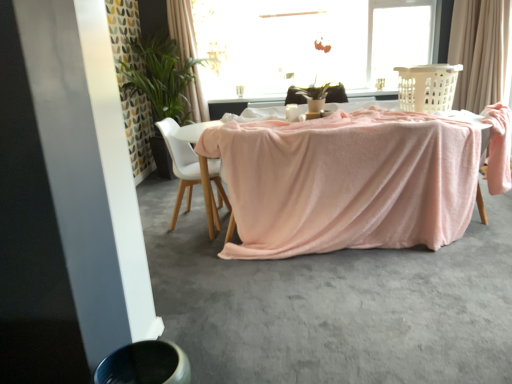
Question: Considering the relative sizes of beige fabric curtain at upper right, the 2th curtain in the left-to-right sequence, and transparent glass window at upper center in the image provided, is beige fabric curtain at upper right, the 2th curtain in the left-to-right sequence, thinner than transparent glass window at upper center?

Choices:
 (A) no
 (B) yes

Answer: (A)

Question: Does beige fabric curtain at upper right, the 2th curtain in the left-to-right sequence, have a greater width compared to transparent glass window at upper center?

Choices:
 (A) yes
 (B) no

Answer: (A)

Question: Considering the relative sizes of beige fabric curtain at upper right, the 2th curtain in the left-to-right sequence, and transparent glass window at upper center in the image provided, is beige fabric curtain at upper right, the 2th curtain in the left-to-right sequence, bigger than transparent glass window at upper center?

Choices:
 (A) no
 (B) yes

Answer: (A)

Question: Does beige fabric curtain at upper right, positioned as the 1th curtain in right-to-left order, have a smaller size compared to transparent glass window at upper center?

Choices:
 (A) yes
 (B) no

Answer: (A)

Question: Is beige fabric curtain at upper right, positioned as the 1th curtain in right-to-left order, positioned in front of transparent glass window at upper center?

Choices:
 (A) no
 (B) yes

Answer: (B)

Question: Does point (425, 72) appear closer or farther from the camera than point (155, 69)?

Choices:
 (A) farther
 (B) closer

Answer: (B)

Question: Looking at the image, does beige plastic laundry basket at upper right seem bigger or smaller compared to green leafy plant at upper left?

Choices:
 (A) small
 (B) big

Answer: (A)

Question: Visually, is beige plastic laundry basket at upper right positioned to the left or to the right of green leafy plant at upper left?

Choices:
 (A) left
 (B) right

Answer: (B)

Question: Considering their positions, is beige plastic laundry basket at upper right located in front of or behind green leafy plant at upper left?

Choices:
 (A) behind
 (B) front

Answer: (B)

Question: Is point (196, 54) positioned closer to the camera than point (285, 271)?

Choices:
 (A) farther
 (B) closer

Answer: (A)

Question: In terms of size, does light beige fabric curtain at upper center, the second curtain when ordered from right to left, appear bigger or smaller than smooth gray concrete at lower center?

Choices:
 (A) small
 (B) big

Answer: (A)

Question: From their relative heights in the image, would you say light beige fabric curtain at upper center, the second curtain when ordered from right to left, is taller or shorter than smooth gray concrete at lower center?

Choices:
 (A) short
 (B) tall

Answer: (B)

Question: Looking at their shapes, would you say light beige fabric curtain at upper center, the second curtain when ordered from right to left, is wider or thinner than smooth gray concrete at lower center?

Choices:
 (A) thin
 (B) wide

Answer: (A)

Question: From the image's perspective, relative to white matte chair at center, is pink velvety table at center above or below?

Choices:
 (A) above
 (B) below

Answer: (B)

Question: Choose the correct answer: Is pink velvety table at center inside white matte chair at center or outside it?

Choices:
 (A) inside
 (B) outside

Answer: (B)